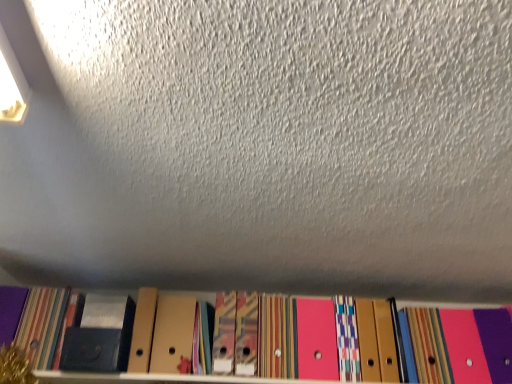
Question: From the image's perspective, is matte black paperback book at lower left, the second paperback book when ordered from right to left, located beneath matte black paperback book at lower left, which is the first paperback book from right to left?

Choices:
 (A) no
 (B) yes

Answer: (A)

Question: Is matte black paperback book at lower left, the second paperback book when ordered from right to left, with matte black paperback book at lower left, the second paperback book positioned from the left?

Choices:
 (A) yes
 (B) no

Answer: (B)

Question: From a real-world perspective, does matte black paperback book at lower left, the second paperback book when ordered from right to left, stand above matte black paperback book at lower left, the second paperback book positioned from the left?

Choices:
 (A) no
 (B) yes

Answer: (B)

Question: Considering the relative sizes of matte black paperback book at lower left, the second paperback book when ordered from right to left, and matte black paperback book at lower left, which is the first paperback book from right to left, in the image provided, is matte black paperback book at lower left, the second paperback book when ordered from right to left, smaller than matte black paperback book at lower left, which is the first paperback book from right to left,?

Choices:
 (A) yes
 (B) no

Answer: (B)

Question: Is matte black paperback book at lower left, the second paperback book when ordered from right to left, outside matte black paperback book at lower left, which is the first paperback book from right to left?

Choices:
 (A) yes
 (B) no

Answer: (A)

Question: From a real-world perspective, is matte black paperback book at lower left, the second paperback book when ordered from right to left, above or below cardboard folders at lower center?

Choices:
 (A) above
 (B) below

Answer: (A)

Question: Is matte black paperback book at lower left, the second paperback book when ordered from right to left, in front of or behind cardboard folders at lower center in the image?

Choices:
 (A) behind
 (B) front

Answer: (A)

Question: From the image's perspective, is matte black paperback book at lower left, which appears as the 1th paperback book when viewed from the left, positioned above or below cardboard folders at lower center?

Choices:
 (A) below
 (B) above

Answer: (A)

Question: Looking at their shapes, would you say matte black paperback book at lower left, the second paperback book when ordered from right to left, is wider or thinner than cardboard folders at lower center?

Choices:
 (A) wide
 (B) thin

Answer: (B)

Question: In terms of height, does cardboard folders at lower center look taller or shorter compared to matte black paperback book at lower left, the second paperback book positioned from the left?

Choices:
 (A) short
 (B) tall

Answer: (A)

Question: In the image, is cardboard folders at lower center positioned in front of or behind matte black paperback book at lower left, the second paperback book positioned from the left?

Choices:
 (A) front
 (B) behind

Answer: (A)

Question: Which is correct: cardboard folders at lower center is inside matte black paperback book at lower left, which is the first paperback book from right to left, or outside of it?

Choices:
 (A) outside
 (B) inside

Answer: (A)

Question: Looking at their shapes, would you say cardboard folders at lower center is wider or thinner than matte black paperback book at lower left, which is the first paperback book from right to left?

Choices:
 (A) thin
 (B) wide

Answer: (B)

Question: Visually, is matte black paperback book at lower left, which is the first paperback book from right to left, positioned to the left or to the right of matte black paperback book at lower left, which appears as the 1th paperback book when viewed from the left?

Choices:
 (A) left
 (B) right

Answer: (B)

Question: In terms of width, does matte black paperback book at lower left, the second paperback book positioned from the left, look wider or thinner when compared to matte black paperback book at lower left, which appears as the 1th paperback book when viewed from the left?

Choices:
 (A) thin
 (B) wide

Answer: (B)